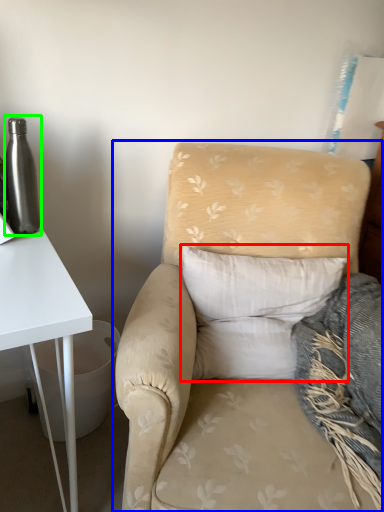
Question: Considering the real-world distances, which object is closest to pillow (highlighted by a red box)? chair (highlighted by a blue box) or bottle (highlighted by a green box).

Choices:
 (A) chair
 (B) bottle

Answer: (A)